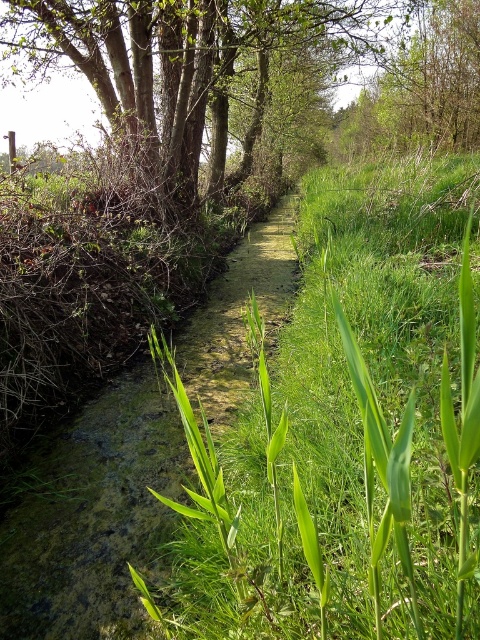
Question: Does brown rough tree at upper left appear on the left side of green leafy tree at upper center?

Choices:
 (A) no
 (B) yes

Answer: (B)

Question: Is green leafy grass at center thinner than green leafy tree at upper center?

Choices:
 (A) yes
 (B) no

Answer: (A)

Question: Which point is farther to the camera?

Choices:
 (A) green leafy grass at center
 (B) green leafy tree at upper center

Answer: (B)

Question: Does green leafy grass at center have a lesser width compared to green leafy tree at upper center?

Choices:
 (A) yes
 (B) no

Answer: (A)

Question: Which object is positioned closest to the green leafy grass at center?

Choices:
 (A) green leafy tree at upper center
 (B) brown rough tree at upper left

Answer: (B)

Question: Which point appears closest to the camera in this image?

Choices:
 (A) (334, 145)
 (B) (348, 308)
 (C) (130, 12)

Answer: (B)